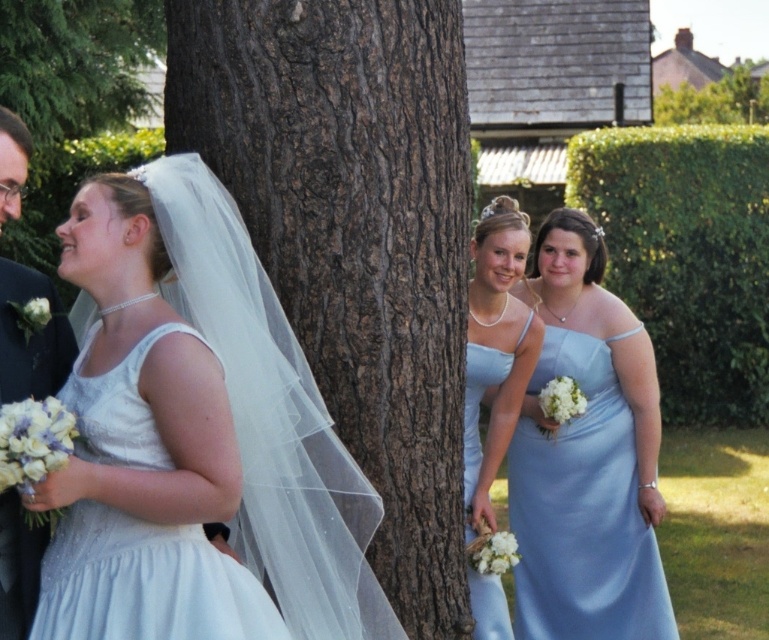
Question: Which of these objects is positioned closest to the white satin dress at left?

Choices:
 (A) light blue satin dress at center
 (B) light blue satin dress at right

Answer: (A)

Question: Which point is farther to the camera?

Choices:
 (A) light blue satin dress at center
 (B) matte black suit at left

Answer: (A)

Question: Is light blue satin dress at right wider than light blue satin dress at center?

Choices:
 (A) yes
 (B) no

Answer: (A)

Question: Which object is closer to the camera taking this photo?

Choices:
 (A) brown rough bark at center
 (B) matte black suit at left
 (C) light blue satin dress at right
 (D) light blue satin dress at center

Answer: (B)

Question: Can you confirm if brown rough bark at center is wider than light blue satin dress at right?

Choices:
 (A) no
 (B) yes

Answer: (B)

Question: Does brown rough bark at center have a lesser width compared to light blue satin dress at right?

Choices:
 (A) no
 (B) yes

Answer: (A)